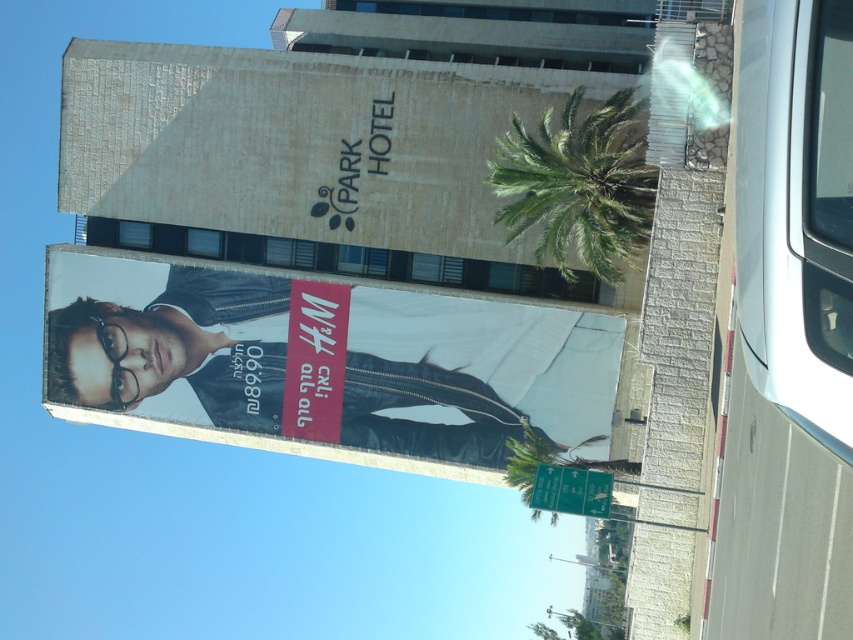
Question: Which object appears closest to the camera in this image?

Choices:
 (A) matte black jacket at center
 (B) matte stone billboard at center

Answer: (B)

Question: Based on their relative distances, which object is nearer to the matte stone billboard at center?

Choices:
 (A) green leafy palm tree at upper right
 (B) matte black jacket at center

Answer: (B)

Question: In this image, where is matte black jacket at center located relative to green leafy palm tree at upper right?

Choices:
 (A) above
 (B) below

Answer: (B)

Question: Which point is closer to the camera?

Choices:
 (A) green leafy palm tree at upper right
 (B) matte black jacket at center
 (C) matte stone billboard at center

Answer: (A)

Question: Is matte black jacket at center to the left of green leafy palm tree at upper right from the viewer's perspective?

Choices:
 (A) yes
 (B) no

Answer: (A)

Question: Is matte black jacket at center to the right of matte stone billboard at center from the viewer's perspective?

Choices:
 (A) yes
 (B) no

Answer: (B)